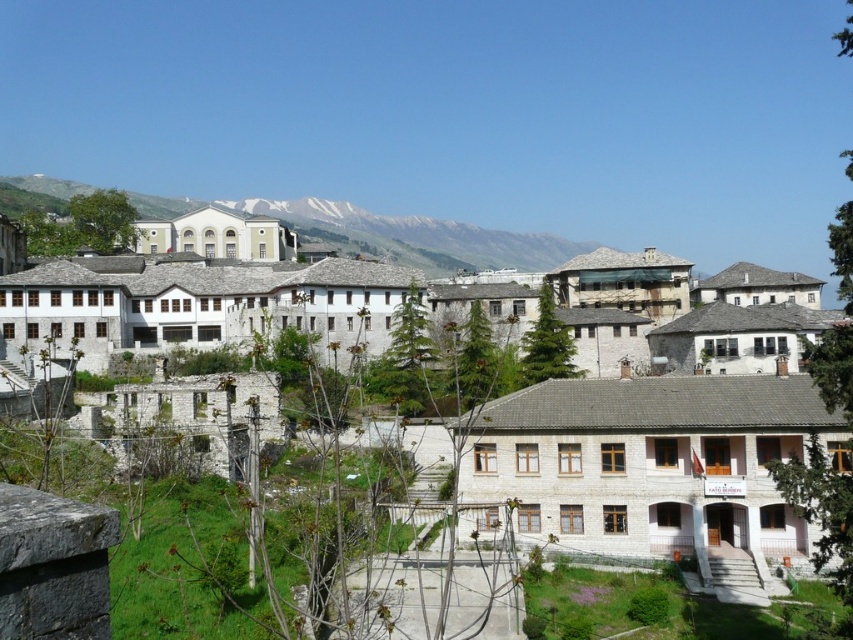
Does white stone building at center have a greater width compared to white snow-covered mountain at upper center?

No.

Based on the photo, is white stone building at center taller than white snow-covered mountain at upper center?

No.

Is point (770, 476) closer to viewer compared to point (44, 192)?

Yes, it is in front of point (44, 192).

Find the location of `white stone building at center`. white stone building at center is located at coordinates (650, 464).